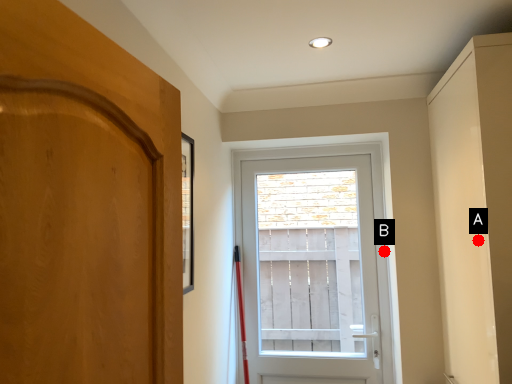
Question: Two points are circled on the image, labeled by A and B beside each circle. Which of the following is the closest to the observer?

Choices:
 (A) A is closer
 (B) B is closer

Answer: (A)